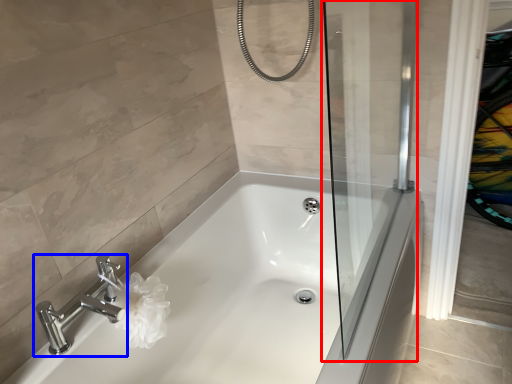
Question: Which object appears closest to the camera in this image, screen door (highlighted by a red box) or tap (highlighted by a blue box)?

Choices:
 (A) screen door
 (B) tap

Answer: (A)